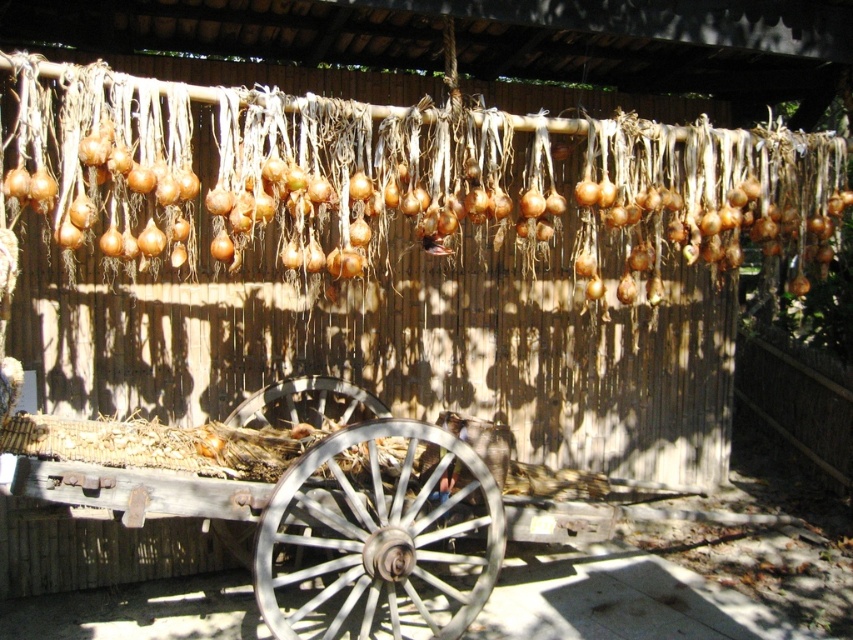
You are standing in the rustic outdoor setting described. You need to locate the silver metallic wagon wheel at center. What are the coordinates where you should look to find it?

The silver metallic wagon wheel at center is located at coordinates point [379,536].

You are standing in front of the wooden cart and notice two wagon wheels. The silver metallic wagon wheel at center and the wooden wagon wheel at center. Which one is taller?

The silver metallic wagon wheel at center is taller than the wooden wagon wheel at center.